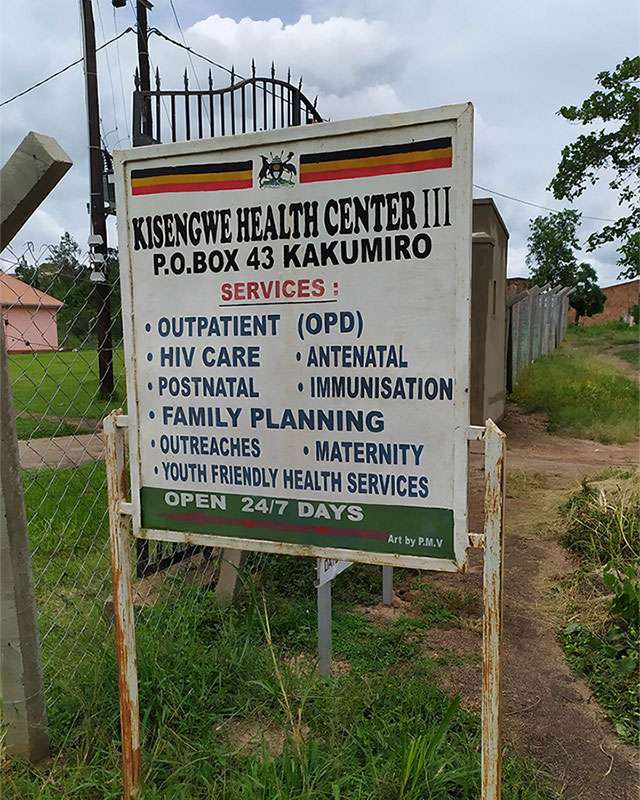
You are a GUI agent. You are given a task and a screenshot of the screen. Output one action in this format:
    pyautogui.click(x=<x>, y=<y>)
    Task: Click on the wood supports
    
    Given the screenshot: What is the action you would take?
    pyautogui.click(x=490, y=576), pyautogui.click(x=120, y=546)